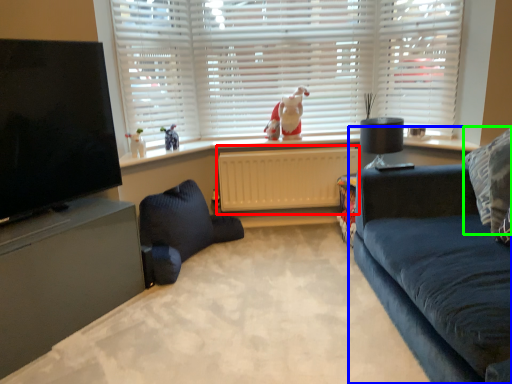
Question: Which is nearer to the radiator (highlighted by a red box)? studio couch (highlighted by a blue box) or pillow (highlighted by a green box).

Choices:
 (A) studio couch
 (B) pillow

Answer: (A)